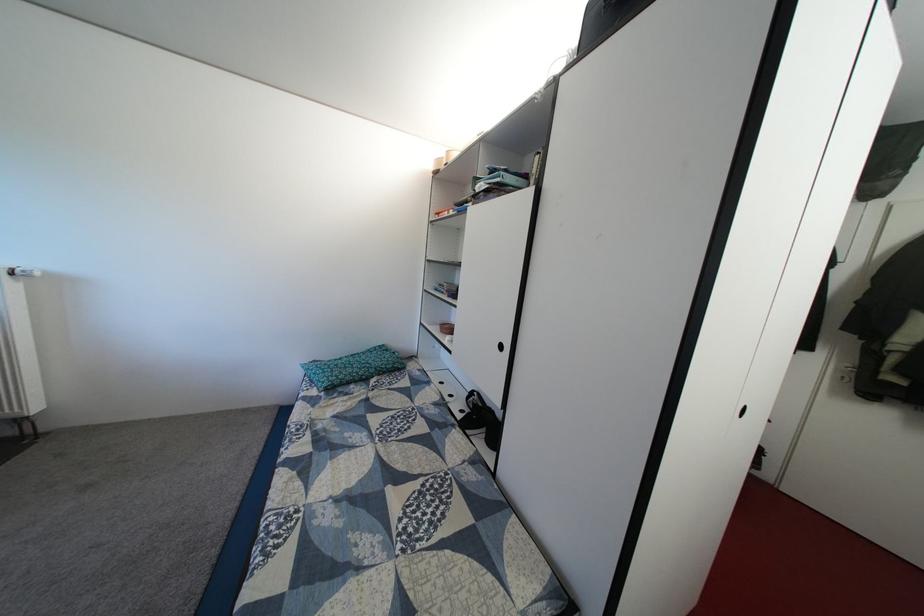
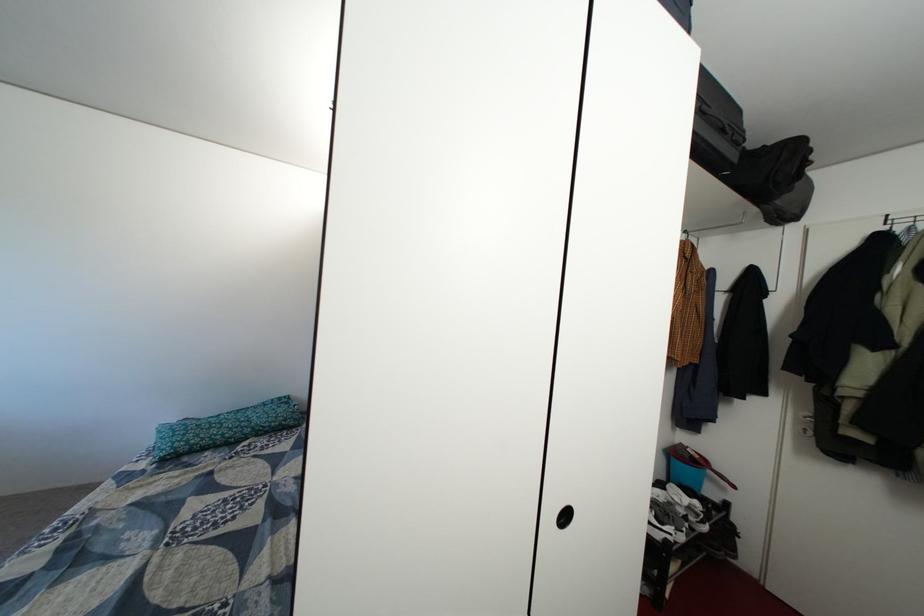
Find the pixel in the second image that matches (357,374) in the first image.

(222, 435)